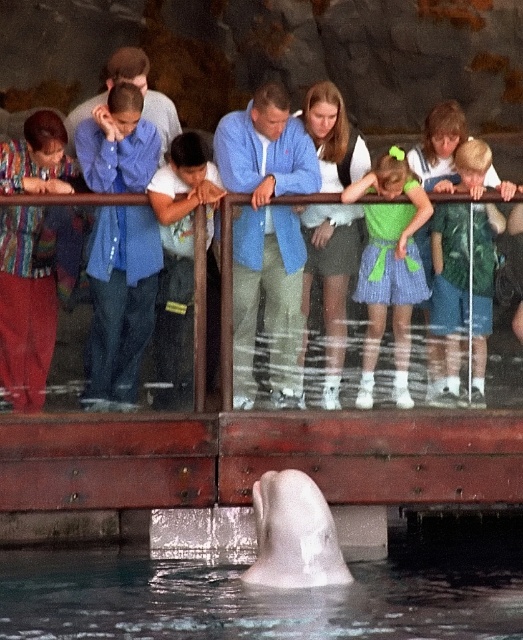
You are a tour guide leading a group at the marine park. You notice a child wearing a green textured dress at center and a white smooth dolphin at lower center. The safety guidelines state that visitors must stay at least 4 meters away from the dolphin exhibit. Is the child currently within the safe distance?

The distance between the green textured dress at center and the white smooth dolphin at lower center is 4.17 meters, which is just over the 4 meter requirement. Therefore, the child is within the safe distance as they are slightly farther than the minimum requirement.

You are standing at the entrance of the marine park and want to take a photo of the clear water at dolphin center. Where should you position yourself relative to the wooden red railing to capture the best view?

The clear water at dolphin center is located at point coordinates, so you should position yourself directly in front of the wooden red railing to capture the best view of the clear water at dolphin center.

You are a visitor at the marine park and want to take a photo of the beluga whale. You notice the clear water at dolphin center and the green textured dress at center in your viewfinder. Which object should you adjust your camera to focus on if you want to capture the wider subject?

The clear water at dolphin center is wider than the green textured dress at center, so you should focus on the clear water at dolphin center to capture the wider subject.